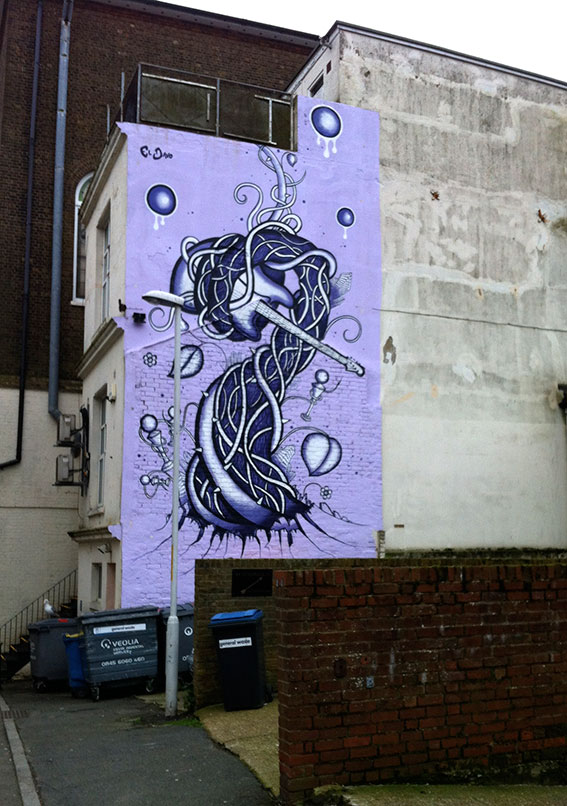
The image size is (567, 806). Identify the location of trash can. (244, 679), (138, 665), (186, 637), (55, 655), (74, 659).